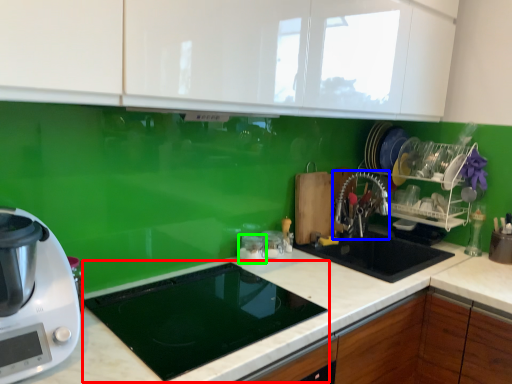
Question: Based on their relative distances, which object is nearer to appliance (highlighted by a red box)? Choose from faucet (highlighted by a blue box) and appliance (highlighted by a green box).

Choices:
 (A) faucet
 (B) appliance

Answer: (B)